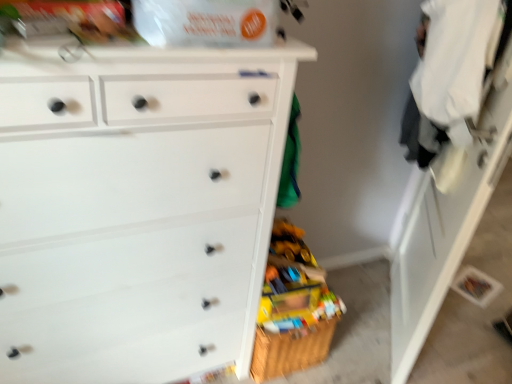
Question: Can you confirm if white matte chest of drawers at left is wider than white glossy cabinet at right?

Choices:
 (A) no
 (B) yes

Answer: (B)

Question: Is white matte chest of drawers at left not within white glossy cabinet at right?

Choices:
 (A) yes
 (B) no

Answer: (A)

Question: From the image's perspective, is white matte chest of drawers at left above white glossy cabinet at right?

Choices:
 (A) yes
 (B) no

Answer: (B)

Question: Is white glossy cabinet at right inside white matte chest of drawers at left?

Choices:
 (A) yes
 (B) no

Answer: (B)

Question: Considering the relative positions of white matte chest of drawers at left and white glossy cabinet at right in the image provided, is white matte chest of drawers at left to the left of white glossy cabinet at right from the viewer's perspective?

Choices:
 (A) yes
 (B) no

Answer: (A)

Question: Does white matte chest of drawers at left have a greater height compared to white glossy cabinet at right?

Choices:
 (A) no
 (B) yes

Answer: (A)

Question: Does white glossy cabinet at right appear on the left side of white matte chest of drawers at left?

Choices:
 (A) no
 (B) yes

Answer: (A)

Question: From the image's perspective, is white glossy cabinet at right located beneath white matte chest of drawers at left?

Choices:
 (A) yes
 (B) no

Answer: (B)

Question: From the image's perspective, would you say white glossy cabinet at right is positioned over white matte chest of drawers at left?

Choices:
 (A) yes
 (B) no

Answer: (A)

Question: Is white matte chest of drawers at left a part of white glossy cabinet at right?

Choices:
 (A) no
 (B) yes

Answer: (A)

Question: Could you tell me if white glossy cabinet at right is facing white matte chest of drawers at left?

Choices:
 (A) no
 (B) yes

Answer: (B)

Question: Is white glossy cabinet at right closer to the viewer compared to white matte chest of drawers at left?

Choices:
 (A) no
 (B) yes

Answer: (A)

Question: From the image's perspective, is white glossy cabinet at right positioned above or below white matte chest of drawers at left?

Choices:
 (A) below
 (B) above

Answer: (B)